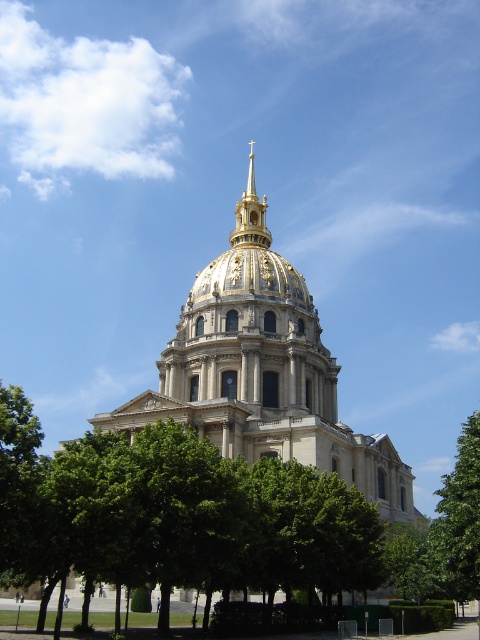
You are standing in front of a grand historical building with a golden dome and surrounded by trees. You want to take a photo of the green leafy tree at right without the building in the frame. Is the distance sufficient to step back and capture the tree alone?

The green leafy tree at right is 45.11 meters from the camera. Since the tree is relatively far away, stepping back a few meters would likely allow you to frame the tree without including the building in the photo.

In the scene shown: You are an architect analyzing the proportions of the scene. Given that the beige stone dome at center is a key architectural element, how does the size of the green leafy tree at center compare to it?

The green leafy tree at center is smaller than the beige stone dome at center.